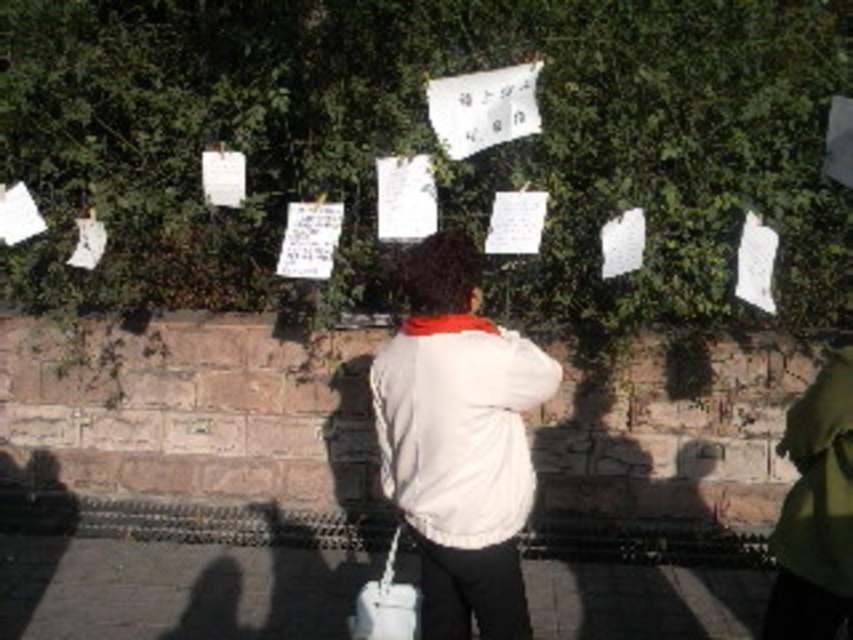
In the scene shown: The white fabric jacket at center is 13.86 feet away from the fence. Can a person with an arm span of 6 feet reach the fence while wearing the jacket?

The distance between the white fabric jacket at center and the fence is 13.86 feet, which is greater than the person arm span of 6 feet. Therefore, the person cannot reach the fence while wearing the jacket.

You are a landscape architect designing a garden. You need to place a small bench between the green leafy hedge at upper center and the white fabric at center. Based on their widths, which object should the bench be closer to?

The green leafy hedge at upper center might be wider than the white fabric at center, so the bench should be placed closer to the white fabric at center to ensure it fits within the narrower space.

Consider the image. You are a photographer trying to capture a photo of the green leafy hedge at upper center and the white fabric at center. Which object should you focus on first if you want to ensure both are in focus without adjusting the camera settings?

The green leafy hedge at upper center is above the white fabric at center, so focusing on the white fabric at center first will ensure both are within the depth of field since it is closer to the camera.